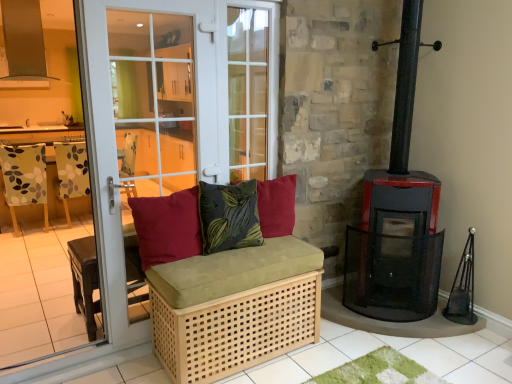
Locate an element on the screen. free spot to the right of natural wood woven basket at lower center is located at coordinates pyautogui.click(x=346, y=353).